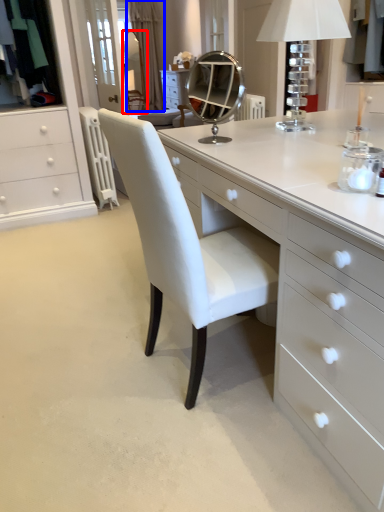
Question: Which object appears closest to the camera in this image, mirror (highlighted by a red box) or curtain (highlighted by a blue box)?

Choices:
 (A) mirror
 (B) curtain

Answer: (A)